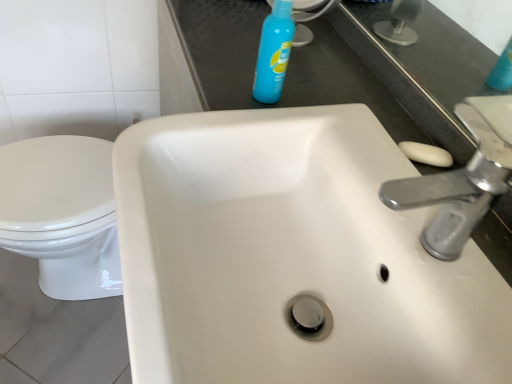
At what (x,y) coordinates should I click in order to perform the action: click on free space to the back side of silver metallic faucet at upper right. Please return your answer as a coordinate pair (x, y). Image resolution: width=512 pixels, height=384 pixels. Looking at the image, I should click on (366, 151).